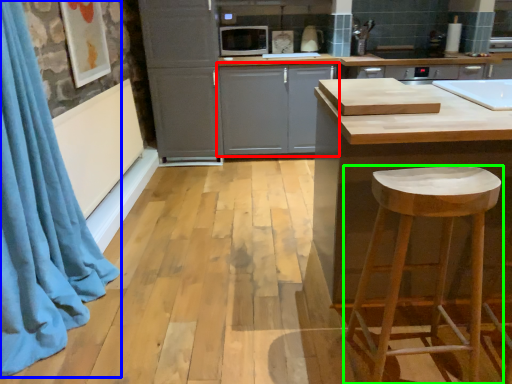
Question: Estimate the real-world distances between objects in this image. Which object is closer to cabinetry (highlighted by a red box), shower curtain (highlighted by a blue box) or stool (highlighted by a green box)?

Choices:
 (A) shower curtain
 (B) stool

Answer: (A)